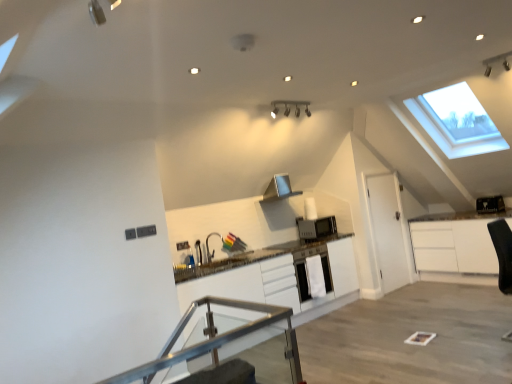
Question: Considering the positions of black plastic toaster at upper right, acting as the 2th appliance starting from the bottom, and white matte door at right in the image, is black plastic toaster at upper right, acting as the 2th appliance starting from the bottom, taller or shorter than white matte door at right?

Choices:
 (A) tall
 (B) short

Answer: (B)

Question: Do you think black plastic toaster at upper right, acting as the 2th appliance starting from the bottom, is within white matte door at right, or outside of it?

Choices:
 (A) outside
 (B) inside

Answer: (A)

Question: Estimate the real-world distances between objects in this image. Which object is farther from the black leather swivel chair at lower right?

Choices:
 (A) white matte door at right
 (B) transparent glass table at center
 (C) silver metallic exhaust hood at center
 (D) white matte cabinet at center
 (E) white matte dishwasher at center

Answer: (B)

Question: Based on their relative distances, which object is farther from the transparent glass table at center?

Choices:
 (A) white matte door at right
 (B) black leather swivel chair at lower right
 (C) silver metallic exhaust hood at center
 (D) satin silver microwave at center, placed as the 1th appliance when sorted from bottom to top
 (E) white matte cabinet at center

Answer: (B)